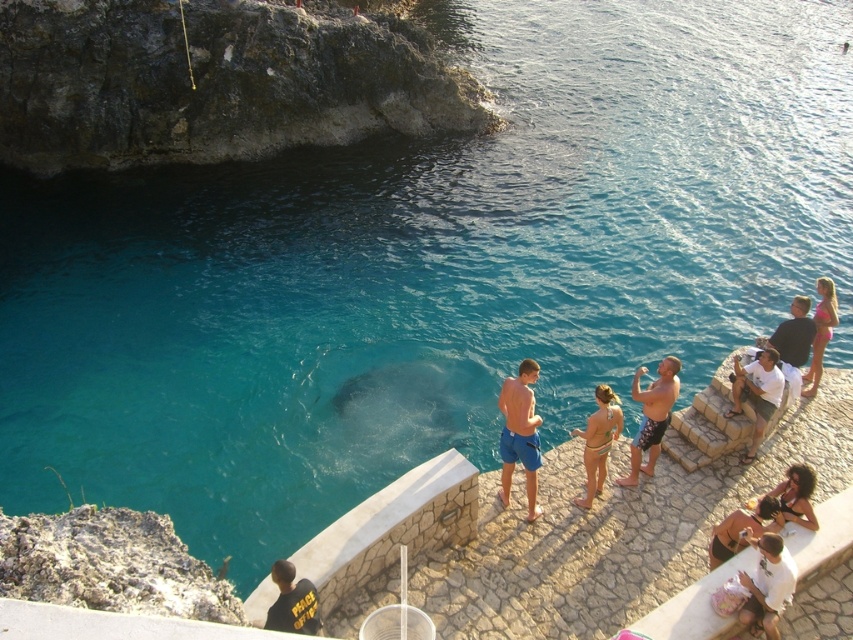
You are a photographer standing at the cliff edge. You want to take a photo that includes both the dark gray rock at upper left and the white cotton shirt at lower right. Which object will appear larger in the photo?

The dark gray rock at upper left will appear larger in the photo because it is taller than the white cotton shirt at lower right.

You are a photographer trying to capture a group photo of the printed swim trunks at center and dark blue shorts at right. Which one should you focus on first if you want to ensure both are in frame without moving the camera?

The printed swim trunks at center is larger in size than dark blue shorts at right, so focusing on the printed swim trunks at center first will help ensure both are in frame since it occupies more space in the image.